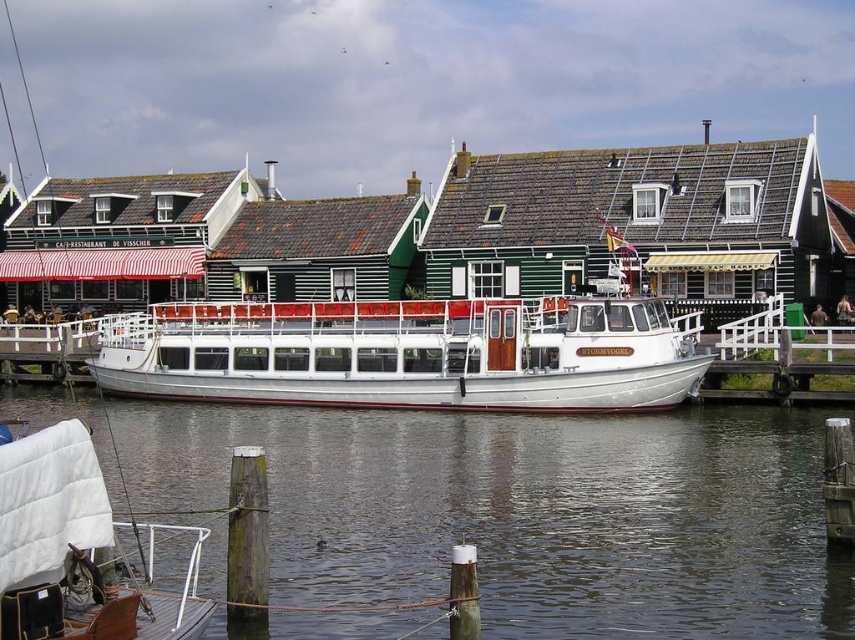
You are a tourist standing on the pier and want to take a photo of the white polished wood boat at center. However, you notice the clear water at lower center is blocking your view. Can you move to the left or right to avoid the water and still see the boat?

The clear water at lower center is below the white polished wood boat at center, so moving to the left or right might still allow you to see the boat while avoiding the water.

Based on the photo, you are a tourist standing on the pier and want to take a photo of the white polished wood boat at center and the clear water at lower center. Which object should you focus on first if you want to capture both in the same frame without moving your camera?

The white polished wood boat at center is positioned to the left of the clear water at lower center, so you should focus on the white polished wood boat at center first to ensure both are in the frame.

From the picture: You are standing at the pier and want to take a photo of the boat and the cafe sign. You notice two points marked on your map at coordinates point (205, 515) and point (652, 404). Which point should you stand at to ensure both the boat named Stormvogel and the cafe sign are clearly visible in your photo?

You should stand at point (205, 515) because it is closer to the camera, providing a better vantage point to capture both the boat named Stormvogel and the cafe sign clearly.